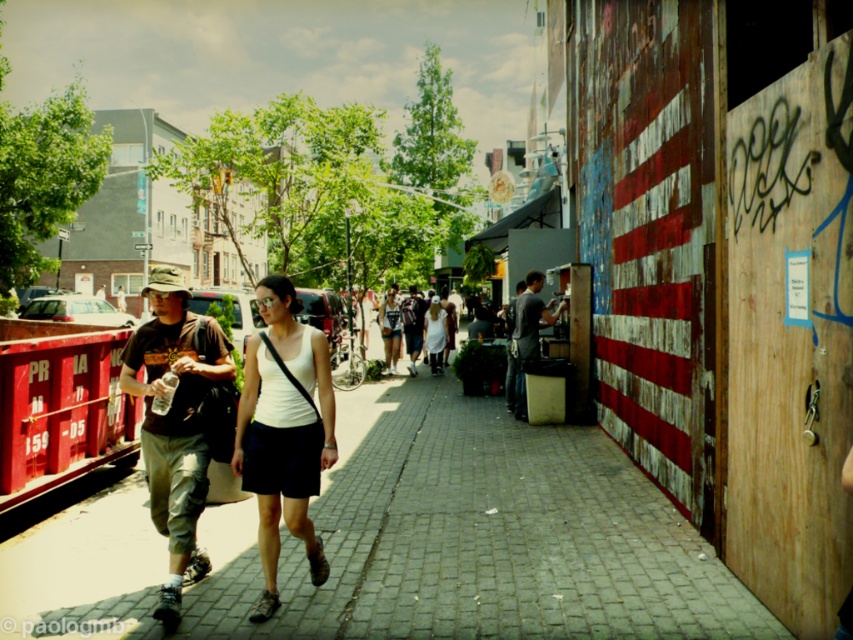
Can you confirm if camouflage fabric hat at left is positioned to the left of dark gray shirt at center?

Correct, you'll find camouflage fabric hat at left to the left of dark gray shirt at center.

Can you confirm if camouflage fabric hat at left is positioned to the right of dark gray shirt at center?

In fact, camouflage fabric hat at left is to the left of dark gray shirt at center.

The width and height of the screenshot is (853, 640). What do you see at coordinates (175, 420) in the screenshot?
I see `camouflage fabric hat at left` at bounding box center [175, 420].

Find the location of a particular element. The width and height of the screenshot is (853, 640). camouflage fabric hat at left is located at coordinates (175, 420).

Can you confirm if brick pavement at center is positioned above white cotton dress at center?

Actually, brick pavement at center is below white cotton dress at center.

Can you confirm if brick pavement at center is taller than white cotton dress at center?

No, brick pavement at center is not taller than white cotton dress at center.

The height and width of the screenshot is (640, 853). I want to click on brick pavement at center, so click(x=474, y=536).

What are the coordinates of `brick pavement at center` in the screenshot? It's located at (474, 536).

Does dark gray shirt at center have a smaller size compared to white matte tank top at center?

Actually, dark gray shirt at center might be larger than white matte tank top at center.

Which is behind, point (521, 400) or point (399, 353)?

The point (399, 353) is more distant.

Who is more distant from viewer, (515, 310) or (387, 294)?

The point (387, 294) is behind.

Where is `dark gray shirt at center`? The image size is (853, 640). dark gray shirt at center is located at coordinates (527, 333).